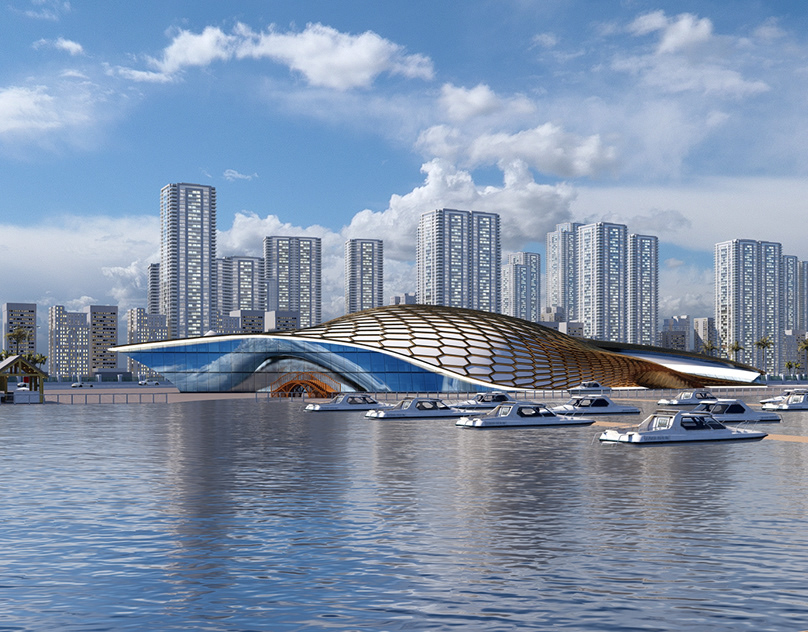
At what (x,y) coordinates should I click in order to perform the action: click on glass. Please return your answer as a coordinate pair (x, y). Looking at the image, I should click on (237, 363).